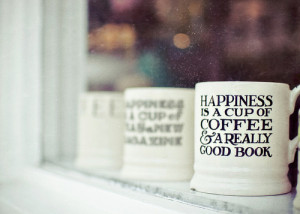
Locate an element on the screen. windowsil is located at coordinates click(x=176, y=185).